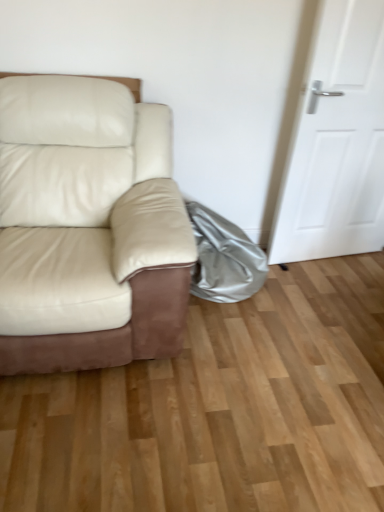
Question: From a real-world perspective, is matte cream leather couch at left located beneath shiny metallic bag at lower right?

Choices:
 (A) no
 (B) yes

Answer: (A)

Question: Would you say matte cream leather couch at left is outside shiny metallic bag at lower right?

Choices:
 (A) no
 (B) yes

Answer: (B)

Question: Considering the relative positions of matte cream leather couch at left and shiny metallic bag at lower right in the image provided, is matte cream leather couch at left to the right of shiny metallic bag at lower right from the viewer's perspective?

Choices:
 (A) no
 (B) yes

Answer: (A)

Question: Is matte cream leather couch at left next to shiny metallic bag at lower right?

Choices:
 (A) yes
 (B) no

Answer: (B)

Question: From the image's perspective, is matte cream leather couch at left over shiny metallic bag at lower right?

Choices:
 (A) no
 (B) yes

Answer: (B)

Question: Is shiny metallic bag at lower right inside the boundaries of matte cream leather couch at left, or outside?

Choices:
 (A) outside
 (B) inside

Answer: (A)

Question: From a real-world perspective, is shiny metallic bag at lower right positioned above or below matte cream leather couch at left?

Choices:
 (A) below
 (B) above

Answer: (A)

Question: In terms of height, does shiny metallic bag at lower right look taller or shorter compared to matte cream leather couch at left?

Choices:
 (A) short
 (B) tall

Answer: (A)

Question: Considering the relative positions of shiny metallic bag at lower right and matte cream leather couch at left in the image provided, is shiny metallic bag at lower right to the left or to the right of matte cream leather couch at left?

Choices:
 (A) right
 (B) left

Answer: (A)

Question: From a real-world perspective, is white matte door at right positioned above or below matte cream leather couch at left?

Choices:
 (A) above
 (B) below

Answer: (A)

Question: From the image's perspective, is white matte door at right located above or below matte cream leather couch at left?

Choices:
 (A) below
 (B) above

Answer: (B)

Question: Is white matte door at right in front of or behind matte cream leather couch at left in the image?

Choices:
 (A) front
 (B) behind

Answer: (B)

Question: In terms of size, does white matte door at right appear bigger or smaller than matte cream leather couch at left?

Choices:
 (A) big
 (B) small

Answer: (B)

Question: Looking at their shapes, would you say shiny metallic bag at lower right is wider or thinner than white matte door at right?

Choices:
 (A) wide
 (B) thin

Answer: (A)

Question: Considering the positions of point pos(220,245) and point pos(354,237), is point pos(220,245) closer or farther from the camera than point pos(354,237)?

Choices:
 (A) farther
 (B) closer

Answer: (B)